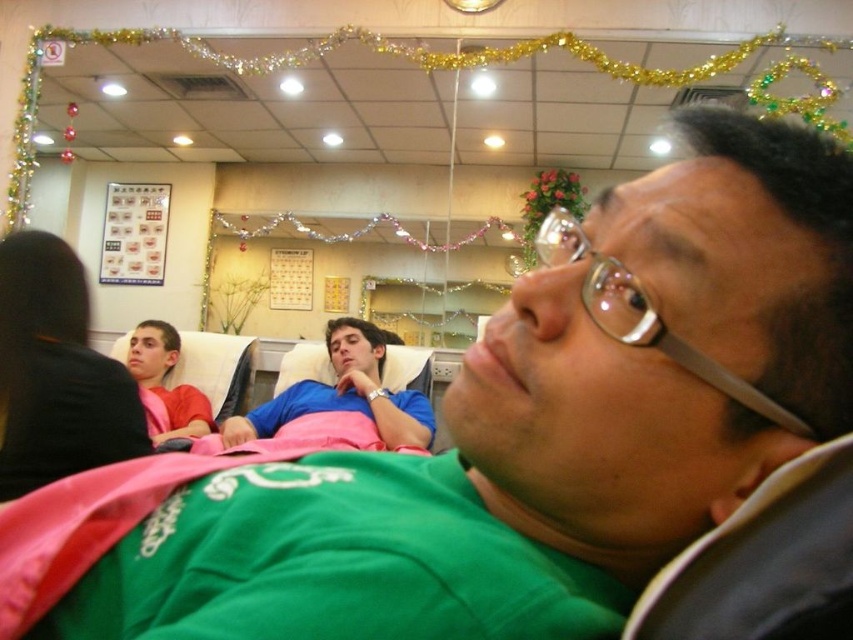
Based on the photo, is pink fabric at left behind blue cotton shirt at center?

That is False.

Which is in front, point (76, 458) or point (399, 433)?

Point (76, 458) is in front.

Image resolution: width=853 pixels, height=640 pixels. Identify the location of pink fabric at left. (56, 372).

What are the coordinates of `pink fabric at left` in the screenshot? It's located at (56, 372).

Is point (22, 317) farther from camera compared to point (138, 385)?

No, (22, 317) is closer to viewer.

Who is more distant from viewer, (24, 428) or (175, 358)?

Positioned behind is point (175, 358).

Where is `pink fabric at left`? pink fabric at left is located at coordinates (56, 372).

Between blue cotton shirt at center and matte pink shirt at left, which one is positioned lower?

blue cotton shirt at center

Can you confirm if blue cotton shirt at center is thinner than matte pink shirt at left?

In fact, blue cotton shirt at center might be wider than matte pink shirt at left.

Who is more forward, (347, 401) or (196, 412)?

Positioned in front is point (347, 401).

Find the location of a particular element. The width and height of the screenshot is (853, 640). blue cotton shirt at center is located at coordinates (344, 394).